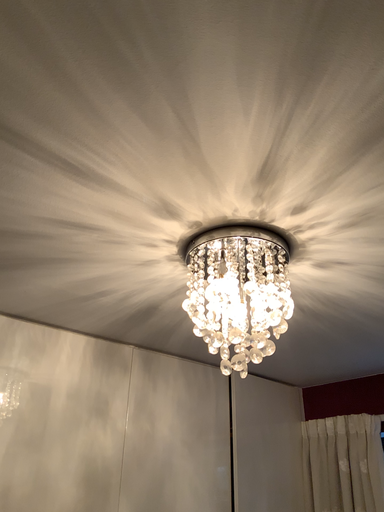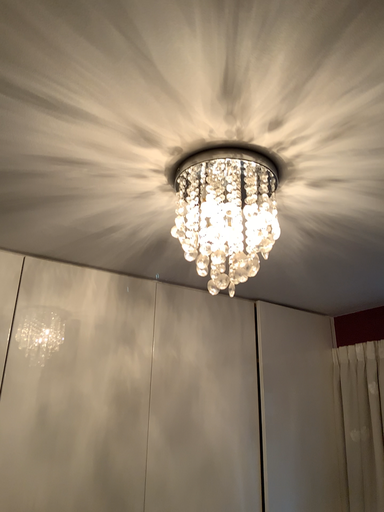
Question: Which way did the camera rotate in the video?

Choices:
 (A) rotated upward
 (B) rotated downward

Answer: (B)